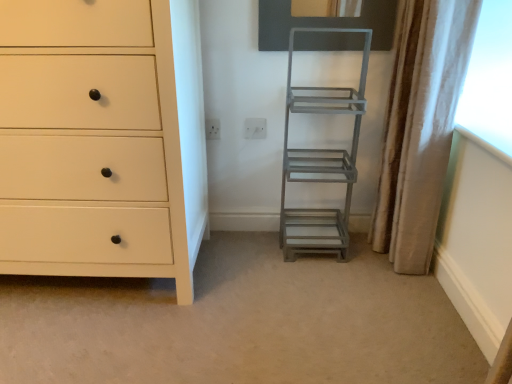
Question: Considering their positions, is beige fabric curtain at right located in front of or behind white plastic electric outlet at center, the 2th electric outlet in the right-to-left sequence?

Choices:
 (A) behind
 (B) front

Answer: (B)

Question: Is beige fabric curtain at right wider or thinner than white plastic electric outlet at center, the 2th electric outlet in the right-to-left sequence?

Choices:
 (A) thin
 (B) wide

Answer: (B)

Question: Which object is the closest to the beige fabric curtain at right?

Choices:
 (A) gray matte metal ladder at center-right
 (B) matte white chest of drawers at left
 (C) white plastic electric outlet at center, the 1th electric outlet from the left
 (D) white plastic electric outlet at center, the second electric outlet viewed from the left

Answer: (A)

Question: Which object is the farthest from the white plastic electric outlet at center, the 2th electric outlet in the right-to-left sequence?

Choices:
 (A) matte white chest of drawers at left
 (B) beige fabric curtain at right
 (C) gray matte metal ladder at center-right
 (D) white plastic electric outlet at center, marked as the first electric outlet in a right-to-left arrangement

Answer: (B)